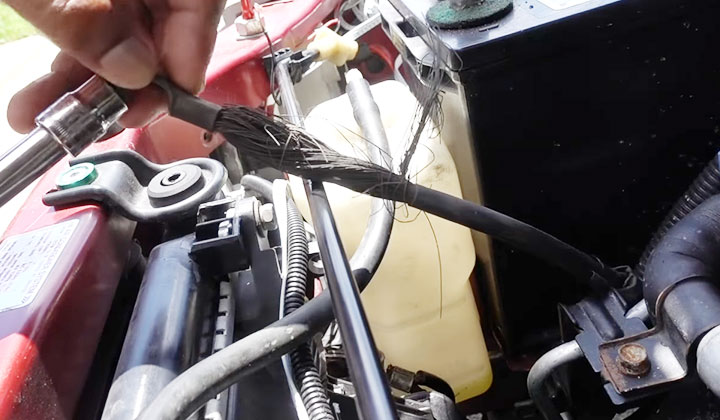
Locate an element on the screen. rusty knob is located at coordinates (628, 359).